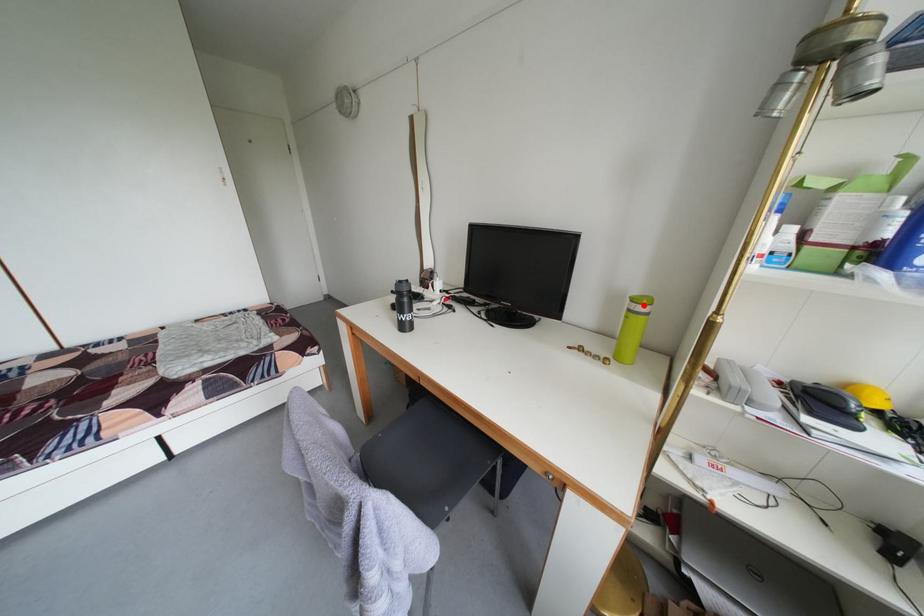
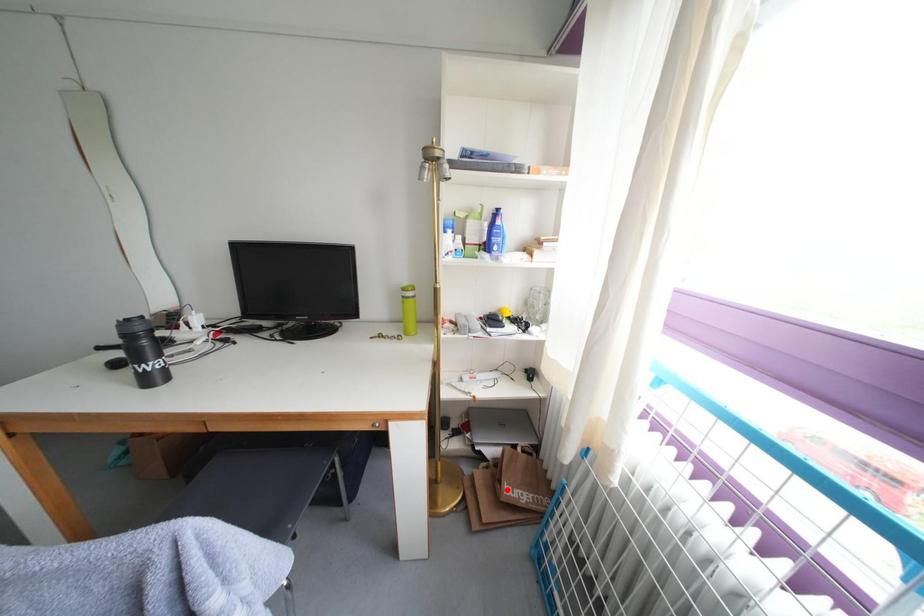
I am providing you with two images of the same scene from different viewpoints. A red point is marked on the first image and another point is marked on the second image. Are the points marked in image1 and image2 representing the same 3D position?

No